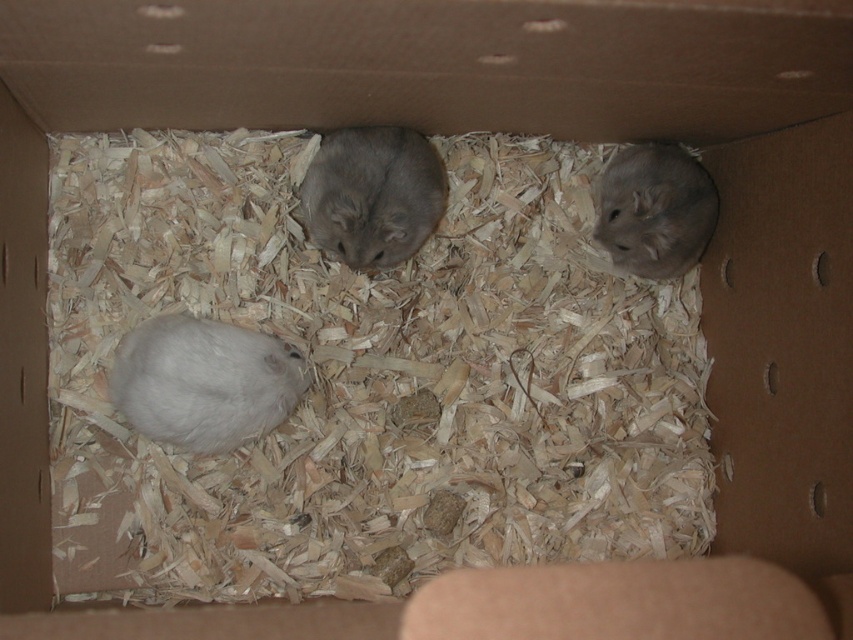
Question: Which of the following is the closest to the observer?

Choices:
 (A) (698, 192)
 (B) (268, 390)
 (C) (314, 225)

Answer: (B)

Question: Can you confirm if white fluffy mouse at lower left is positioned above gray soft fur hamster at center?

Choices:
 (A) no
 (B) yes

Answer: (A)

Question: Which of the following is the farthest from the observer?

Choices:
 (A) gray soft fur hamster at center
 (B) white fluffy mouse at lower left

Answer: (A)

Question: Which object is positioned closest to the gray soft fur hamster at center?

Choices:
 (A) white fluffy mouse at lower left
 (B) gray soft fur hamster at right

Answer: (A)

Question: Can you confirm if white fluffy mouse at lower left is smaller than gray soft fur hamster at center?

Choices:
 (A) yes
 (B) no

Answer: (B)

Question: Is white fluffy mouse at lower left to the right of gray soft fur hamster at center from the viewer's perspective?

Choices:
 (A) no
 (B) yes

Answer: (A)